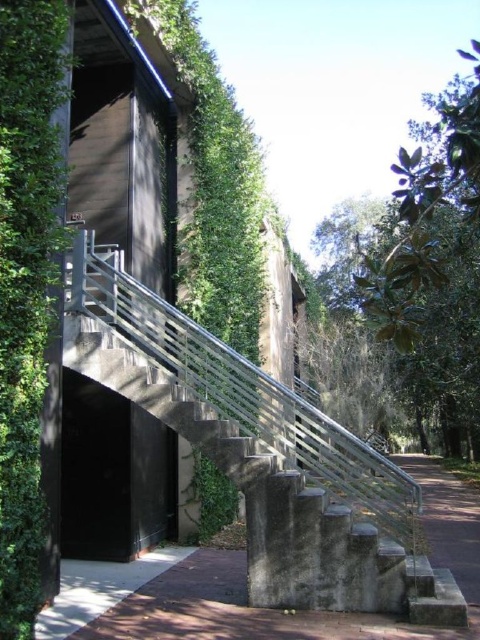
Can you confirm if concrete/stone stairs at center is positioned to the right of green leafy tree at upper right?

In fact, concrete/stone stairs at center is to the left of green leafy tree at upper right.

Does concrete/stone stairs at center have a greater height compared to green leafy tree at upper right?

No, concrete/stone stairs at center is not taller than green leafy tree at upper right.

Is point (325, 502) farther from viewer compared to point (427, 124)?

No, (325, 502) is closer to viewer.

The image size is (480, 640). I want to click on concrete/stone stairs at center, so click(x=276, y=502).